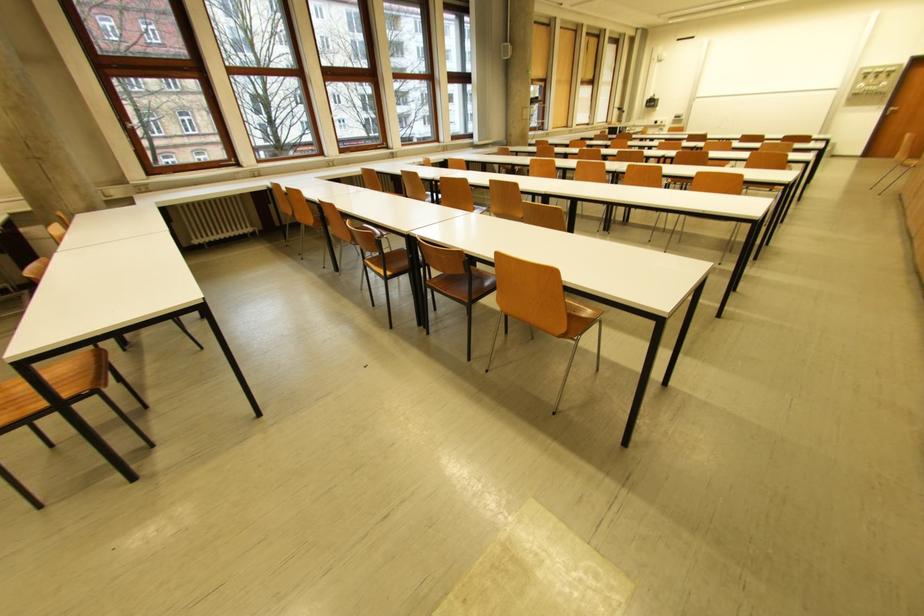
In order to click on door handle in this screenshot , I will do (891, 110).